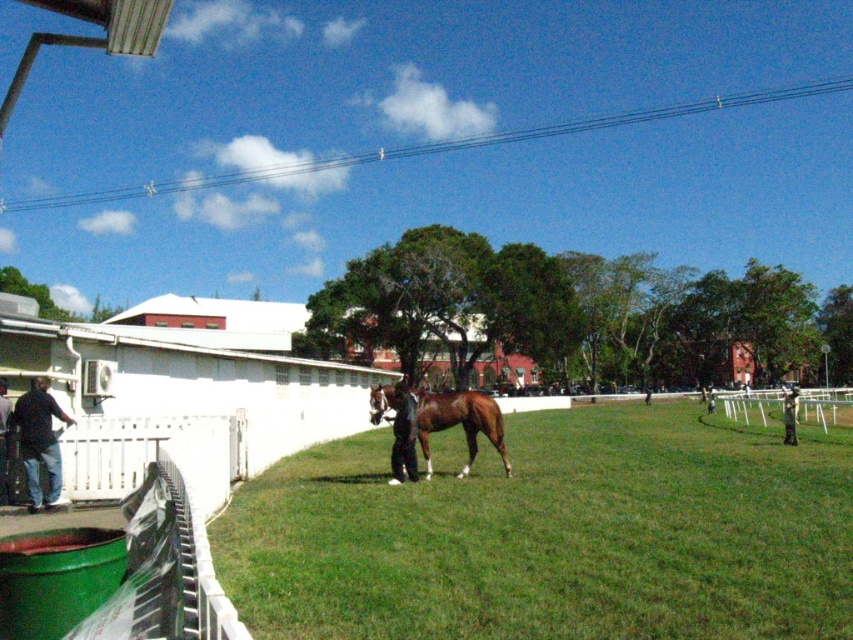
You are standing at the origin point in the image. Which direction should you move to reach the green grass at center?

The green grass at center is located at coordinates 0.834 on the x axis and 0.649 on the y axis, so you should move towards the right and slightly upwards from the origin point to reach it.

You are a photographer standing at the edge of the grassy area. You want to take a picture of the brown glossy horse at center from above. Can you position yourself above the green grass at center to do so?

The green grass at center is below the brown glossy horse at center, so you can position yourself above the green grass at center to take the picture from above the horse.

Looking at this image, you are a photographer positioned at the center of the image. You want to capture a photo of the white wooden fence at lower left without including the dark blue suit at center in the frame. Is it possible to do so by moving only sideways?

The white wooden fence at lower left is to the left of the dark blue suit at center. Since the photographer is at the center, moving sideways to the right would allow them to exclude the dark blue suit at center while still capturing the white wooden fence at lower left in the frame.